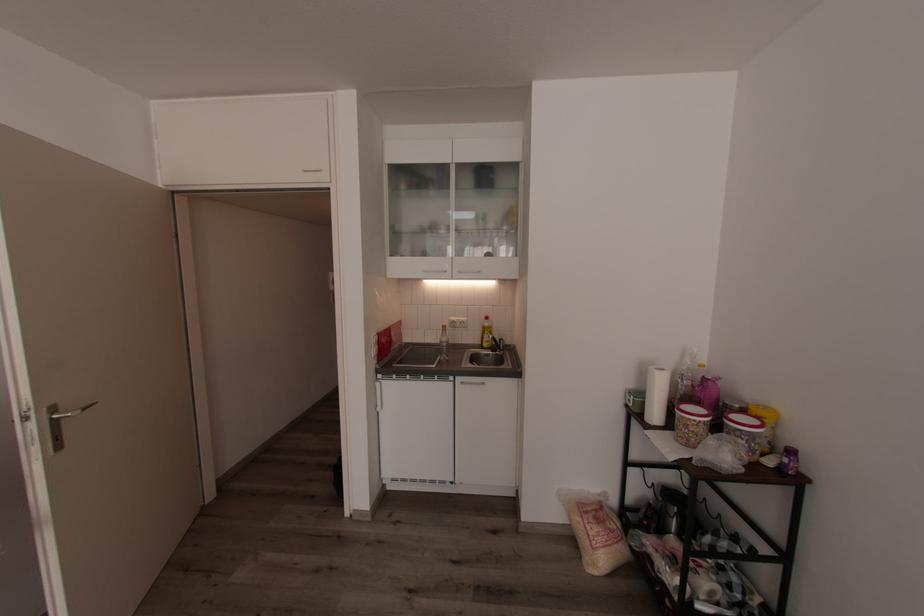
This screenshot has height=616, width=924. What do you see at coordinates (503, 334) in the screenshot?
I see `the faucet handle` at bounding box center [503, 334].